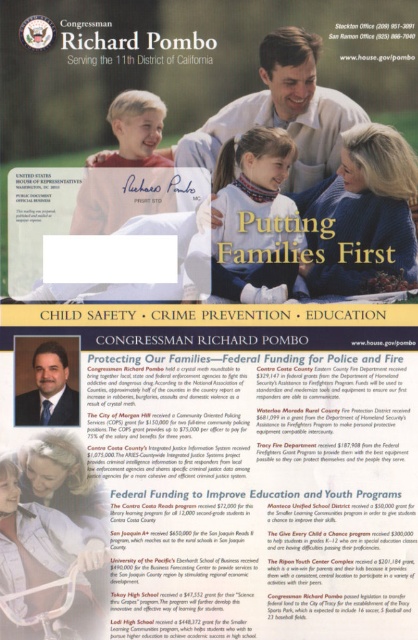
Looking at the promotional flyer for Congressman Richard Pombo, you notice the light blue fabric at center and the blue suit at center. Which one takes up more space in the image?

The light blue fabric at center is larger in size than the blue suit at center, so it takes up more space in the image.

In the scene shown: Where is the light blue fabric at center located in the flyer?

The light blue fabric at center is located at point (x=254, y=218).

Looking at the promotional flyer for Congressman Richard Pombo, you notice a light blue fabric at center and a blue suit at center. Which one appears taller in the image?

The light blue fabric at center is taller than the blue suit at center according to the description.